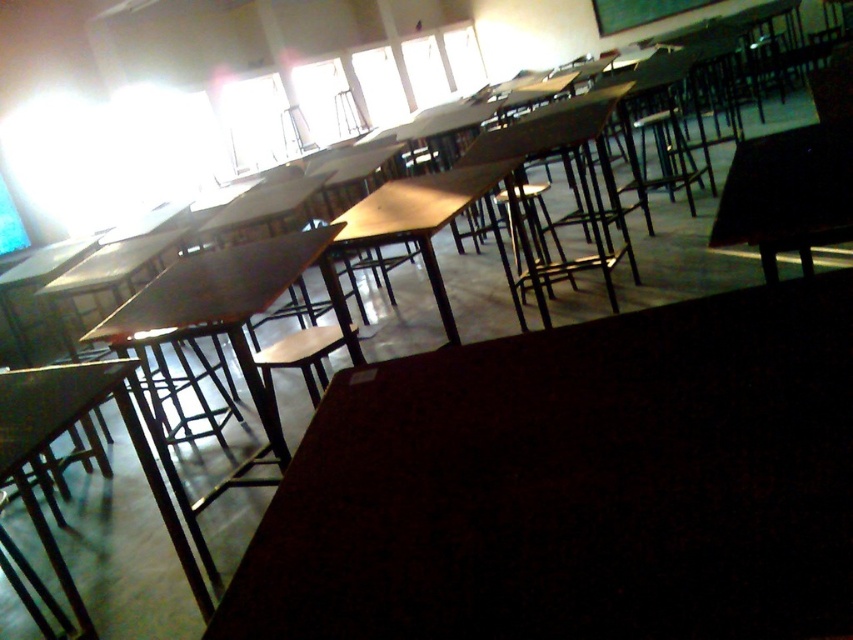
Is black glossy table at right in front of matte black table at lower left?

Yes, it is in front of matte black table at lower left.

Is black glossy table at right wider than matte black table at lower left?

No, black glossy table at right is not wider than matte black table at lower left.

Who is more distant from viewer, (x=762, y=237) or (x=7, y=456)?

Positioned behind is point (x=7, y=456).

Identify the location of black glossy table at right. This screenshot has width=853, height=640. (788, 193).

Between point (163, 483) and point (434, 301), which one is positioned in front?

Point (163, 483) is more forward.

Based on the photo, can you confirm if matte black table at lower left is bigger than wooden table at center?

No, matte black table at lower left is not bigger than wooden table at center.

Who is more forward, (157, 499) or (408, 224)?

Point (157, 499) is in front.

Identify the location of matte black table at lower left. (65, 429).

Between point (849, 205) and point (427, 234), which one is positioned behind?

The point (427, 234) is behind.

Is point (821, 196) closer to camera compared to point (431, 262)?

Yes, it is in front of point (431, 262).

Between point (795, 202) and point (432, 216), which one is positioned behind?

The point (432, 216) is more distant.

You are a GUI agent. You are given a task and a screenshot of the screen. Output one action in this format:
    pyautogui.click(x=<x>, y=<y>)
    Task: Click on the black glossy table at right
    
    Given the screenshot: What is the action you would take?
    pyautogui.click(x=788, y=193)